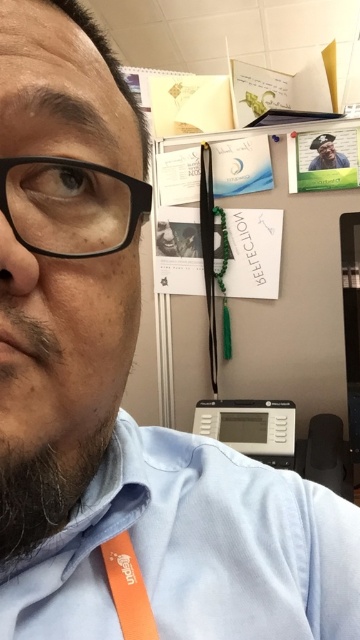
You are a photographer adjusting the focus on a camera. You notice the light blue cotton dress shirt at lower left and the dark brown fuzzy beard at lower left in the frame. Which object should you focus on first if you want to ensure the larger one is in sharp focus?

You should focus on the light blue cotton dress shirt at lower left first because it has a larger size compared to the dark brown fuzzy beard at lower left.

Looking at the person in the selfie, which object has a smaller height between the black plastic glasses at left and the dark brown fuzzy beard at lower left?

The black plastic glasses at left has a lesser height compared to the dark brown fuzzy beard at lower left.

You are a photographer trying to capture a closeup of the light blue cotton dress shirt at lower left. The camera you are using has a minimum focusing distance of 12 inches. Will you be able to take the photo without moving the camera closer?

The distance between the light blue cotton dress shirt at lower left and the camera is 11.25 inches, which is less than the camera minimum focusing distance of 12 inches. Therefore, you will not be able to take the photo without moving the camera further away.